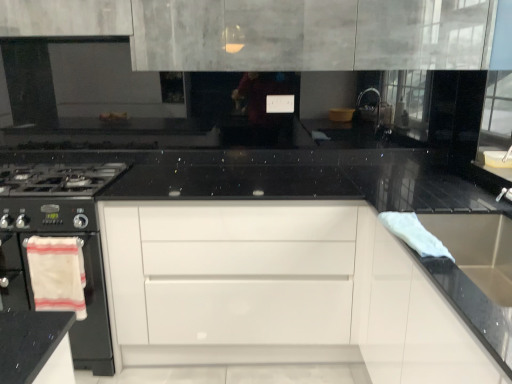
Where is `free point above white cloth at right, marked as the second material in a bottom-to-top arrangement (from a real-world perspective)`? free point above white cloth at right, marked as the second material in a bottom-to-top arrangement (from a real-world perspective) is located at coordinates (409, 225).